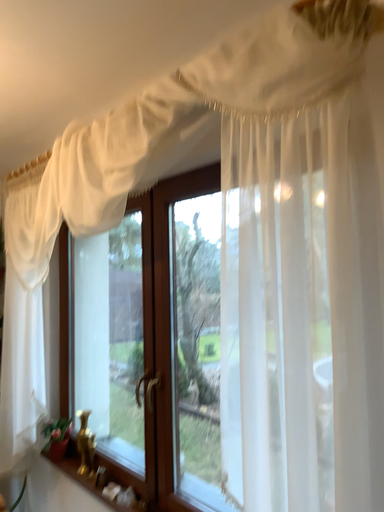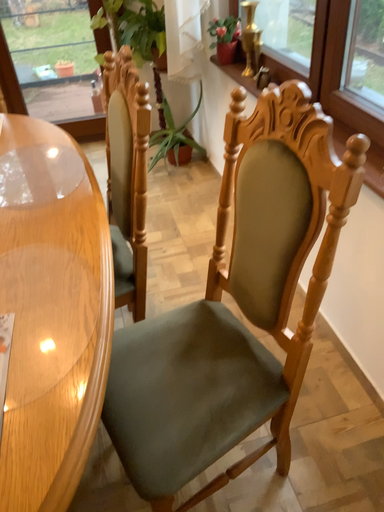
Question: How did the camera likely rotate when shooting the video?

Choices:
 (A) rotated downward
 (B) rotated upward

Answer: (A)